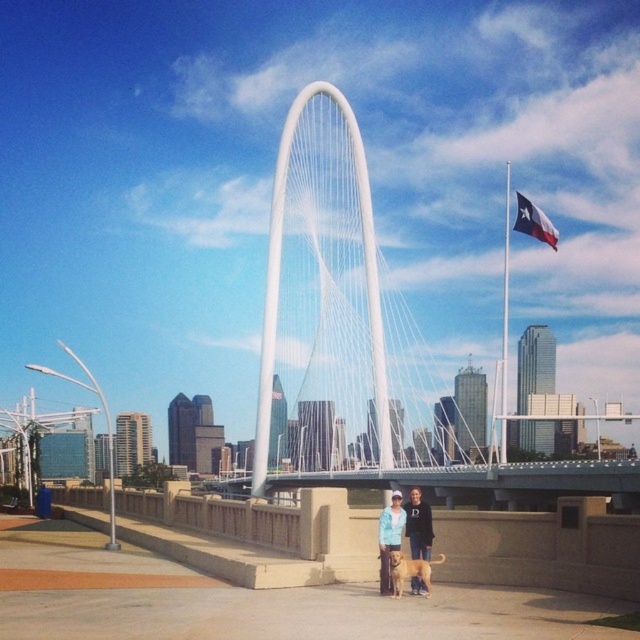
Describe the element at coordinates (403, 531) in the screenshot. I see `golden fur dog at center` at that location.

Between golden fur dog at center and matte blue jacket at center, which one appears on the left side from the viewer's perspective?

matte blue jacket at center

This screenshot has width=640, height=640. I want to click on golden fur dog at center, so click(403, 531).

Which is behind, point (392, 538) or point (541, 214)?

The point (541, 214) is more distant.

The image size is (640, 640). What do you see at coordinates (388, 538) in the screenshot?
I see `matte blue jacket at center` at bounding box center [388, 538].

Which is behind, point (385, 525) or point (516, 195)?

The point (516, 195) is more distant.

Find the location of a particular element. matte blue jacket at center is located at coordinates 388,538.

Which is more to the left, white cable-stayed bridge at center or golden fur dog at center?

white cable-stayed bridge at center is more to the left.

Who is shorter, white cable-stayed bridge at center or golden fur dog at center?

With less height is golden fur dog at center.

Is point (492, 499) behind point (400, 504)?

Yes.

Where is `white cable-stayed bridge at center`? The height and width of the screenshot is (640, 640). white cable-stayed bridge at center is located at coordinates (488, 481).